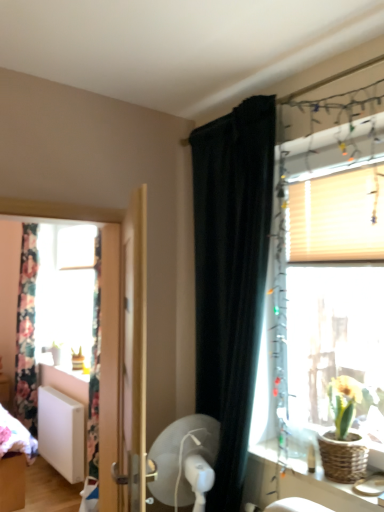
Question: Considering the relative sizes of translucent wood window at right and white matte blind at upper right in the image provided, is translucent wood window at right smaller than white matte blind at upper right?

Choices:
 (A) no
 (B) yes

Answer: (A)

Question: Is translucent wood window at right wider than white matte blind at upper right?

Choices:
 (A) yes
 (B) no

Answer: (A)

Question: Are translucent wood window at right and white matte blind at upper right far apart?

Choices:
 (A) no
 (B) yes

Answer: (A)

Question: Is white matte blind at upper right inside translucent wood window at right?

Choices:
 (A) no
 (B) yes

Answer: (B)

Question: From the image's perspective, does translucent wood window at right appear lower than white matte blind at upper right?

Choices:
 (A) yes
 (B) no

Answer: (A)

Question: Choose the correct answer: Is floral fabric curtain at left, the first curtain positioned from the left, inside woven wicker vanity at lower right or outside it?

Choices:
 (A) outside
 (B) inside

Answer: (A)

Question: Considering their positions, is floral fabric curtain at left, the 2th curtain when ordered from front to back, located in front of or behind woven wicker vanity at lower right?

Choices:
 (A) front
 (B) behind

Answer: (B)

Question: In terms of width, does floral fabric curtain at left, the 1th curtain when ordered from back to front, look wider or thinner when compared to woven wicker vanity at lower right?

Choices:
 (A) thin
 (B) wide

Answer: (A)

Question: Is floral fabric curtain at left, the 2th curtain when ordered from front to back, taller or shorter than woven wicker vanity at lower right?

Choices:
 (A) short
 (B) tall

Answer: (B)

Question: From the image's perspective, is translucent wood window at right above or below woven wicker vanity at lower right?

Choices:
 (A) above
 (B) below

Answer: (A)

Question: Is translucent wood window at right in front of or behind woven wicker vanity at lower right in the image?

Choices:
 (A) behind
 (B) front

Answer: (A)

Question: Would you say translucent wood window at right is to the left or to the right of woven wicker vanity at lower right in the picture?

Choices:
 (A) left
 (B) right

Answer: (B)

Question: Based on their sizes in the image, would you say translucent wood window at right is bigger or smaller than woven wicker vanity at lower right?

Choices:
 (A) big
 (B) small

Answer: (A)

Question: Is floral fabric curtain at left, the 1th curtain when ordered from back to front, inside the boundaries of wooden door at center, or outside?

Choices:
 (A) outside
 (B) inside

Answer: (A)

Question: Is floral fabric curtain at left, the 1th curtain when ordered from back to front, wider or thinner than wooden door at center?

Choices:
 (A) thin
 (B) wide

Answer: (B)